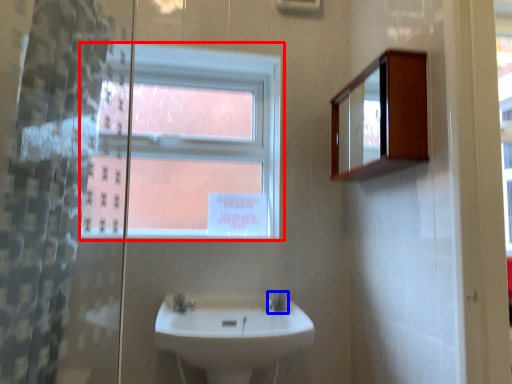
Question: Which object appears closest to the camera in this image, window (highlighted by a red box) or tap (highlighted by a blue box)?

Choices:
 (A) window
 (B) tap

Answer: (B)